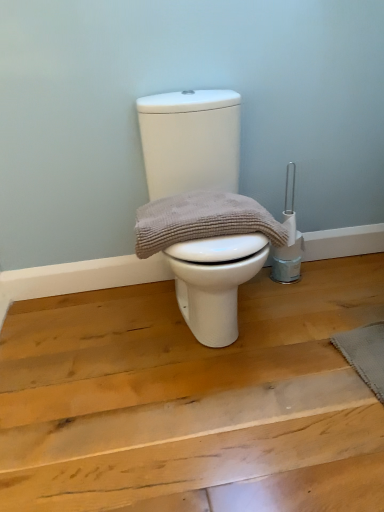
Question: Looking at their shapes, would you say white matte toilet at center is wider or thinner than beige textured towel at center?

Choices:
 (A) thin
 (B) wide

Answer: (B)

Question: From the image's perspective, relative to beige textured towel at center, is white matte toilet at center above or below?

Choices:
 (A) above
 (B) below

Answer: (A)

Question: Estimate the real-world distances between objects in this image. Which object is closer to the gray textured mat at lower right?

Choices:
 (A) white matte toilet at center
 (B) beige textured towel at center

Answer: (B)

Question: Estimate the real-world distances between objects in this image. Which object is farther from the beige textured towel at center?

Choices:
 (A) white matte toilet at center
 (B) gray textured mat at lower right

Answer: (B)